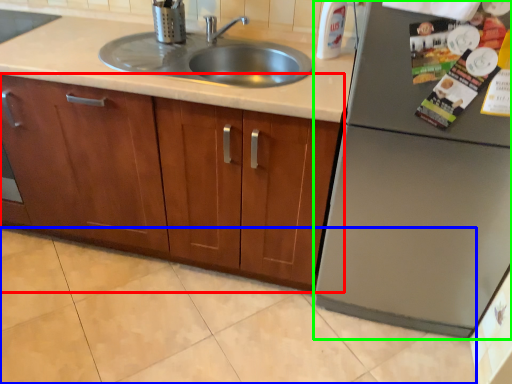
Question: Which is nearer to the cabinetry (highlighted by a red box)? granite (highlighted by a blue box) or appliance (highlighted by a green box).

Choices:
 (A) granite
 (B) appliance

Answer: (A)